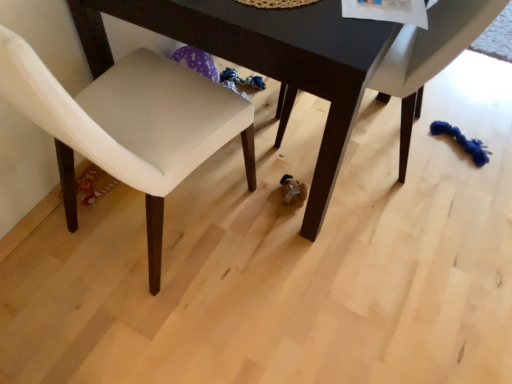
In order to click on free point to the right of white leather chair at lower left, which is counted as the first chair, starting from the left in this screenshot , I will do `click(288, 267)`.